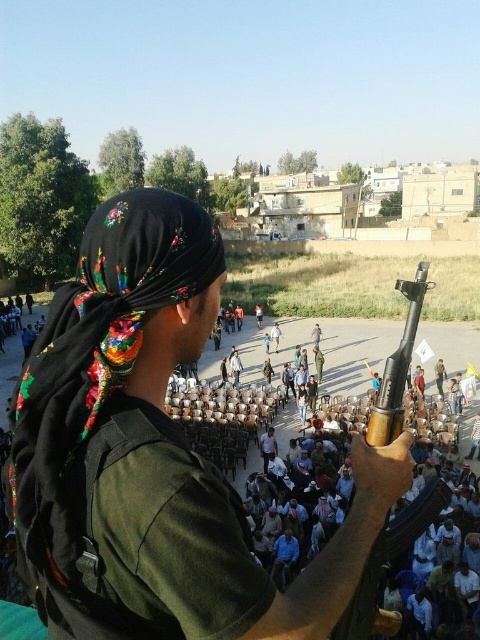
Question: Among these points, which one is farthest from the camera?

Choices:
 (A) (49, 369)
 (B) (432, 561)

Answer: (B)

Question: Which object appears closest to the camera in this image?

Choices:
 (A) black embroidered headscarf at upper left
 (B) white cotton chairs at center

Answer: (B)

Question: Considering the relative positions of white cotton chairs at center and black embroidered headscarf at upper left in the image provided, where is white cotton chairs at center located with respect to black embroidered headscarf at upper left?

Choices:
 (A) left
 (B) right

Answer: (B)

Question: Is white cotton chairs at center smaller than black embroidered headscarf at upper left?

Choices:
 (A) no
 (B) yes

Answer: (A)

Question: Is white cotton chairs at center positioned before black embroidered headscarf at upper left?

Choices:
 (A) yes
 (B) no

Answer: (A)